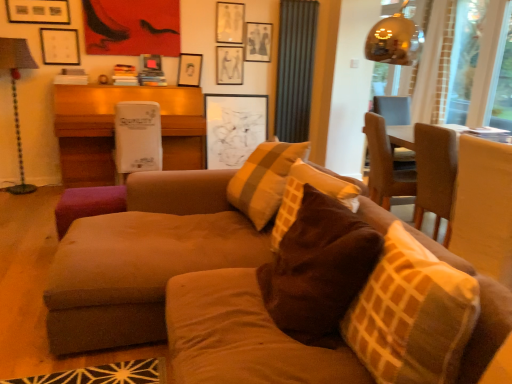
Question: Is white cardboard box at center, acting as the 1th table starting from the back, thinner than white matte picture frame at upper left, the 1th picture frame viewed from the left?

Choices:
 (A) no
 (B) yes

Answer: (A)

Question: From a real-world perspective, is white cardboard box at center, placed as the second table when sorted from front to back, beneath white matte picture frame at upper left, the 1th picture frame viewed from the left?

Choices:
 (A) yes
 (B) no

Answer: (A)

Question: Does white cardboard box at center, placed as the second table when sorted from front to back, have a greater width compared to white matte picture frame at upper left, the 5th picture frame when ordered from right to left?

Choices:
 (A) yes
 (B) no

Answer: (A)

Question: Does white cardboard box at center, the 2th table from the right, have a greater height compared to white matte picture frame at upper left, the 1th picture frame viewed from the left?

Choices:
 (A) no
 (B) yes

Answer: (B)

Question: Does white cardboard box at center, the 1th table positioned from the left, contain white matte picture frame at upper left, the 1th picture frame viewed from the left?

Choices:
 (A) yes
 (B) no

Answer: (B)

Question: Is point (396, 130) closer or farther from the camera than point (18, 165)?

Choices:
 (A) closer
 (B) farther

Answer: (A)

Question: Based on their positions, is wooden table at right, which is counted as the second table, starting from the left, located to the left or right of metallic lampshade at left?

Choices:
 (A) right
 (B) left

Answer: (A)

Question: Looking at their shapes, would you say wooden table at right, the 1th table from the right, is wider or thinner than metallic lampshade at left?

Choices:
 (A) thin
 (B) wide

Answer: (B)

Question: From a real-world perspective, is wooden table at right, the 2th table viewed from the back, physically located above or below metallic lampshade at left?

Choices:
 (A) below
 (B) above

Answer: (A)

Question: Considering the positions of matte white picture frame at upper center, positioned as the 3th picture frame in right-to-left order, and metallic lampshade at left in the image, is matte white picture frame at upper center, positioned as the 3th picture frame in right-to-left order, wider or thinner than metallic lampshade at left?

Choices:
 (A) wide
 (B) thin

Answer: (B)

Question: From a real-world perspective, is matte white picture frame at upper center, positioned as the 3th picture frame in left-to-right order, positioned above or below metallic lampshade at left?

Choices:
 (A) below
 (B) above

Answer: (B)

Question: Is matte white picture frame at upper center, positioned as the 3th picture frame in left-to-right order, bigger or smaller than metallic lampshade at left?

Choices:
 (A) big
 (B) small

Answer: (B)

Question: Does point (237, 64) appear closer or farther from the camera than point (15, 49)?

Choices:
 (A) farther
 (B) closer

Answer: (A)

Question: Is suede couch at center wider or thinner than matte black picture frame at upper center, which appears as the second picture frame when viewed from the right?

Choices:
 (A) thin
 (B) wide

Answer: (B)

Question: Relative to matte black picture frame at upper center, the fourth picture frame from the left, is suede couch at center in front or behind?

Choices:
 (A) front
 (B) behind

Answer: (A)